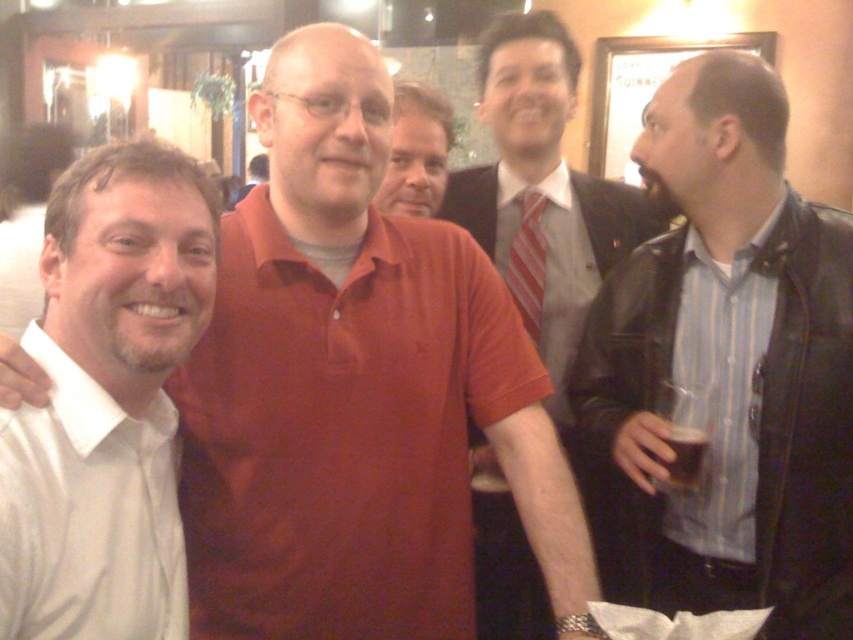
Looking at this image, you are a photographer adjusting your camera settings. You notice two points in the scene labeled as point (596, 332) and point (610, 252). Which point is nearer to your camera lens?

Point (596, 332) is closer to the camera lens than point (610, 252).

You are standing in the scene and want to greet the man wearing the blue striped shirt at right. Based on his position, where should you walk to find him?

The blue striped shirt at right is located at coordinates 0.611 on the x axis and 0.848 on the y axis, so you should walk to that position to find him.